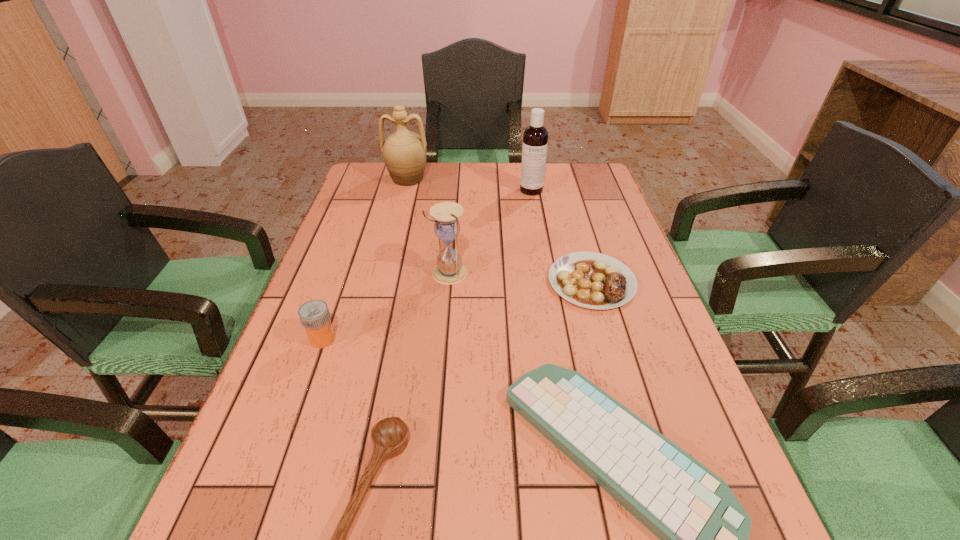
Image resolution: width=960 pixels, height=540 pixels. Find the location of `free location at the far left corner of the desktop`. free location at the far left corner of the desktop is located at coordinates (387, 186).

Where is `blank space at the far right corner`? Image resolution: width=960 pixels, height=540 pixels. blank space at the far right corner is located at coordinates (593, 187).

At what (x,y) coordinates should I click in order to perform the action: click on vacant area that lies between the steak and the hourglass. Please return your answer as a coordinate pair (x, y). Looking at the image, I should click on (520, 278).

This screenshot has height=540, width=960. In order to click on free space that is in between the steak and the pitcher in this screenshot , I will do `click(499, 230)`.

Find the location of a particular element. This screenshot has height=540, width=960. vacant area that lies between the hourglass and the fourth tallest object is located at coordinates (386, 306).

I want to click on free area in between the hourglass and the dishwasher detergent, so [x=490, y=232].

The height and width of the screenshot is (540, 960). I want to click on unoccupied position between the pitcher and the dishwasher detergent, so click(x=469, y=185).

The height and width of the screenshot is (540, 960). What are the coordinates of `the fourth closest object to the wooden spoon` in the screenshot? It's located at (592, 280).

I want to click on object that is the third closest one to the dishwasher detergent, so click(449, 270).

Identify the location of vacant point that satisfies the following two spatial constraints: 1. on the label side of the dishwasher detergent; 2. on the right side of the steak. This screenshot has width=960, height=540. (547, 282).